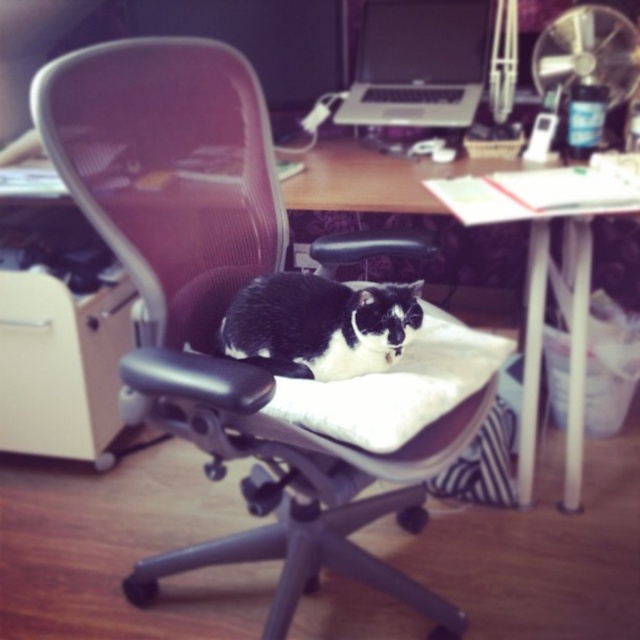
Question: Among these points, which one is nearest to the camera?

Choices:
 (A) (308, 296)
 (B) (403, 77)

Answer: (A)

Question: Which point is farther to the camera?

Choices:
 (A) (250, 292)
 (B) (404, 161)

Answer: (B)

Question: Can you confirm if wooden desk at center is positioned to the right of black glossy monitor at upper center?

Choices:
 (A) yes
 (B) no

Answer: (A)

Question: Does wooden desk at center appear on the right side of black/white fur cat at center?

Choices:
 (A) no
 (B) yes

Answer: (B)

Question: Where is black/white fur cat at center located in relation to black glossy monitor at upper center in the image?

Choices:
 (A) left
 (B) right

Answer: (A)

Question: Among these points, which one is nearest to the camera?

Choices:
 (A) [x=436, y=285]
 (B) [x=380, y=108]

Answer: (B)